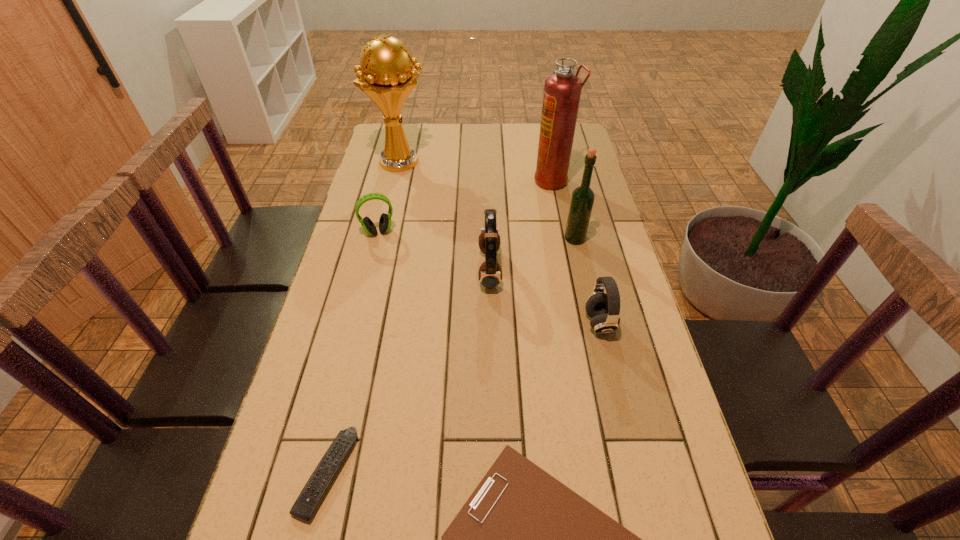
Locate an element on the screen. This screenshot has width=960, height=540. trophy_cup is located at coordinates (386, 75).

Identify the location of fire extinguisher. The image size is (960, 540). (562, 90).

At what (x,y) coordinates should I click in order to perform the action: click on the sixth shortest object. Please return your answer as a coordinate pair (x, y). Looking at the image, I should click on (582, 199).

The height and width of the screenshot is (540, 960). What are the coordinates of `the fourth nearest object` in the screenshot? It's located at (490, 273).

Locate an element on the screen. the tallest headset is located at coordinates (490, 273).

Where is `the nearest headset`? the nearest headset is located at coordinates pos(603,309).

Locate an element on the screen. the sixth farthest object is located at coordinates (603, 309).

Where is `the leftmost headset`? This screenshot has height=540, width=960. the leftmost headset is located at coordinates (385, 219).

Locate an element on the screen. The width and height of the screenshot is (960, 540). remote control is located at coordinates (305, 506).

The image size is (960, 540). Identify the location of vacant space located 0.320m at the front of the trophy_cup where the globe is prominent. (516, 161).